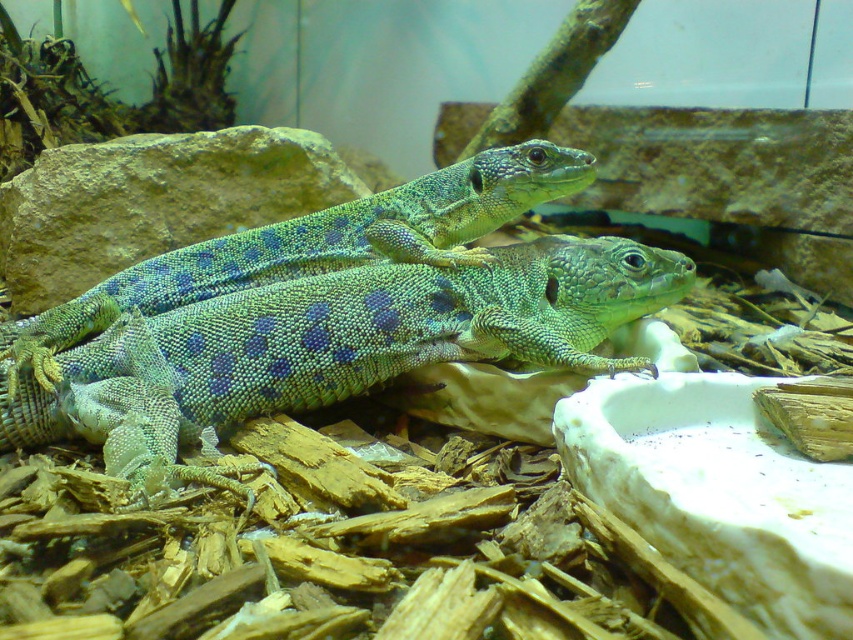
Question: Does green textured lizard at center have a greater width compared to green scaly lizard at center?

Choices:
 (A) no
 (B) yes

Answer: (B)

Question: Among these objects, which one is farthest from the camera?

Choices:
 (A) green scaly lizard at center
 (B) green textured lizard at center

Answer: (A)

Question: Does green textured lizard at center have a larger size compared to green scaly lizard at center?

Choices:
 (A) no
 (B) yes

Answer: (B)

Question: Where is green textured lizard at center located in relation to green scaly lizard at center in the image?

Choices:
 (A) left
 (B) right

Answer: (B)